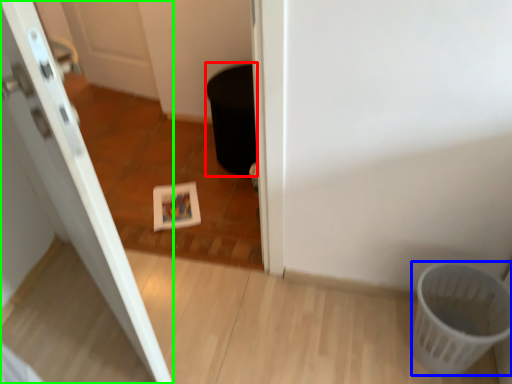
Question: Based on their relative distances, which object is nearer to potty (highlighted by a red box)? Choose from basket (highlighted by a blue box) and door (highlighted by a green box).

Choices:
 (A) basket
 (B) door

Answer: (B)